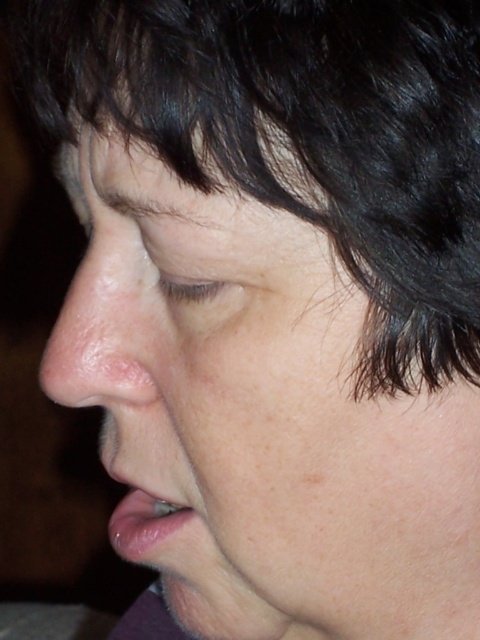
Question: Which point is farther to the camera?

Choices:
 (A) (136, 541)
 (B) (128, 282)

Answer: (A)

Question: Among these objects, which one is nearest to the camera?

Choices:
 (A) smooth skin nose at center
 (B) glossy pink lips at lower left

Answer: (A)

Question: Does smooth skin nose at center appear on the right side of glossy pink lips at lower left?

Choices:
 (A) no
 (B) yes

Answer: (A)

Question: Can you confirm if smooth skin nose at center is positioned to the left of glossy pink lips at lower left?

Choices:
 (A) no
 (B) yes

Answer: (B)

Question: From the image, what is the correct spatial relationship of smooth skin nose at center in relation to glossy pink lips at lower left?

Choices:
 (A) above
 (B) below

Answer: (A)